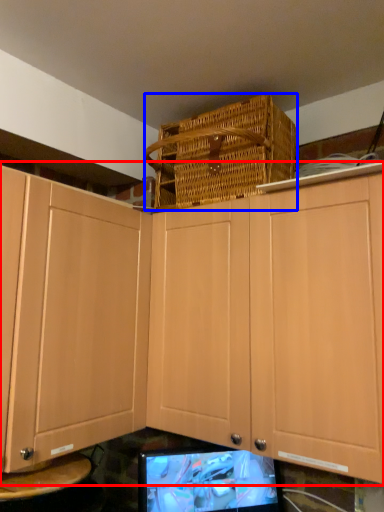
Question: Among these objects, which one is nearest to the camera, cabinetry (highlighted by a red box) or basket (highlighted by a blue box)?

Choices:
 (A) cabinetry
 (B) basket

Answer: (A)